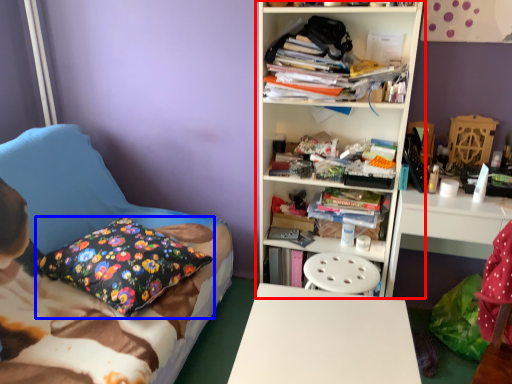
Question: Which object is closer to the camera taking this photo, bookcase (highlighted by a red box) or pillow (highlighted by a blue box)?

Choices:
 (A) bookcase
 (B) pillow

Answer: (B)